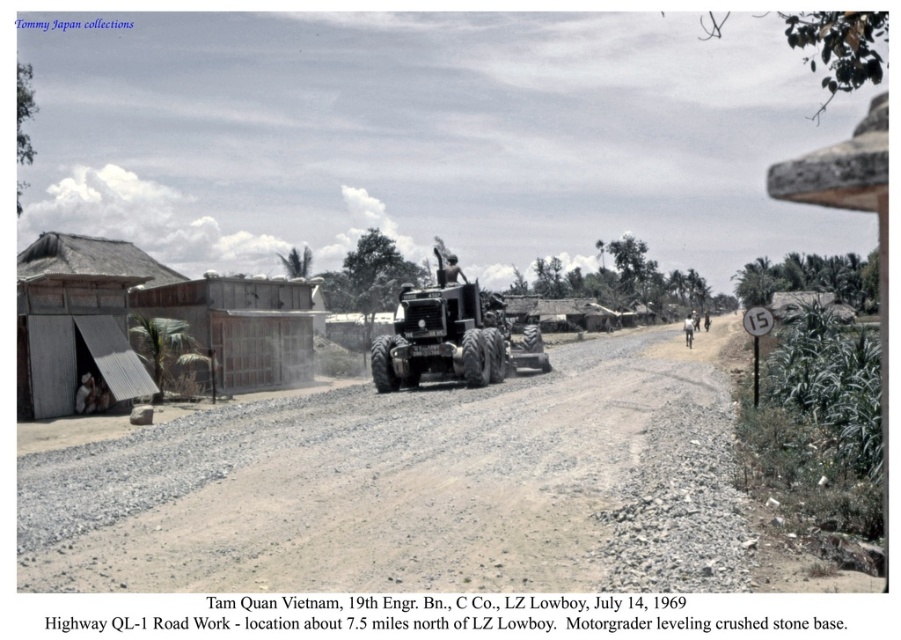
Is point (74, 268) positioned in front of point (223, 278)?

No.

What do you see at coordinates (78, 321) in the screenshot?
I see `metal corrugated hut at left` at bounding box center [78, 321].

At what (x,y) coordinates should I click in order to perform the action: click on metal corrugated hut at left. Please return your answer as a coordinate pair (x, y). The width and height of the screenshot is (901, 640). Looking at the image, I should click on (78, 321).

The width and height of the screenshot is (901, 640). I want to click on metal corrugated hut at left, so click(78, 321).

Is metal corrugated hut at left thinner than brushed metal tractor at center?

Yes.

Which is more to the left, metal corrugated hut at left or brushed metal tractor at center?

metal corrugated hut at left is more to the left.

This screenshot has width=901, height=640. What are the coordinates of `metal corrugated hut at left` in the screenshot? It's located at (78, 321).

Does gravelly dirt track at center come behind brushed metal tractor at center?

That is False.

Identify the location of gravelly dirt track at center. (412, 486).

What do you see at coordinates (412, 486) in the screenshot?
I see `gravelly dirt track at center` at bounding box center [412, 486].

This screenshot has width=901, height=640. Find the location of `gravelly dirt track at center`. gravelly dirt track at center is located at coordinates (412, 486).